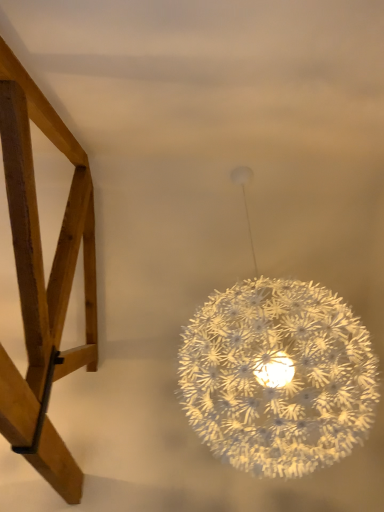
Question: Is wooden chair at left beside white textured sphere at upper center?

Choices:
 (A) yes
 (B) no

Answer: (B)

Question: Is wooden chair at left taller than white textured sphere at upper center?

Choices:
 (A) no
 (B) yes

Answer: (A)

Question: From the image's perspective, does wooden chair at left appear lower than white textured sphere at upper center?

Choices:
 (A) yes
 (B) no

Answer: (B)

Question: From a real-world perspective, is wooden chair at left located higher than white textured sphere at upper center?

Choices:
 (A) no
 (B) yes

Answer: (B)

Question: Is wooden chair at left aimed at white textured sphere at upper center?

Choices:
 (A) no
 (B) yes

Answer: (A)

Question: Does wooden chair at left have a larger size compared to white textured sphere at upper center?

Choices:
 (A) no
 (B) yes

Answer: (A)

Question: Considering the relative sizes of white textured sphere at upper center and wooden chair at left in the image provided, is white textured sphere at upper center bigger than wooden chair at left?

Choices:
 (A) yes
 (B) no

Answer: (A)

Question: Can you confirm if white textured sphere at upper center is wider than wooden chair at left?

Choices:
 (A) no
 (B) yes

Answer: (A)

Question: Does white textured sphere at upper center appear on the right side of wooden chair at left?

Choices:
 (A) yes
 (B) no

Answer: (A)

Question: From the image's perspective, is white textured sphere at upper center above wooden chair at left?

Choices:
 (A) yes
 (B) no

Answer: (B)

Question: Is white textured sphere at upper center aimed at wooden chair at left?

Choices:
 (A) yes
 (B) no

Answer: (B)

Question: Is white textured sphere at upper center closer to the viewer compared to wooden chair at left?

Choices:
 (A) yes
 (B) no

Answer: (B)

Question: Is white textured sphere at upper center to the left or to the right of wooden chair at left in the image?

Choices:
 (A) right
 (B) left

Answer: (A)